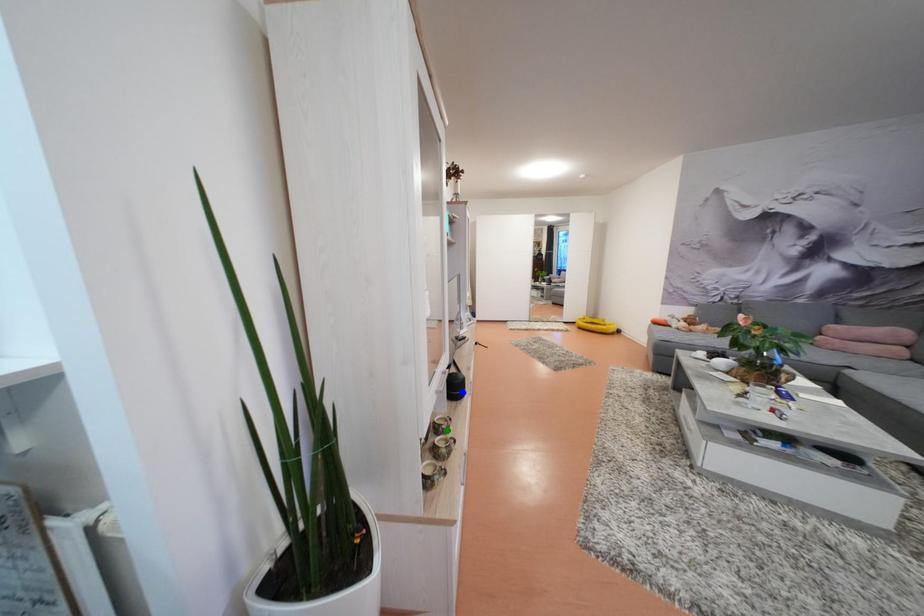
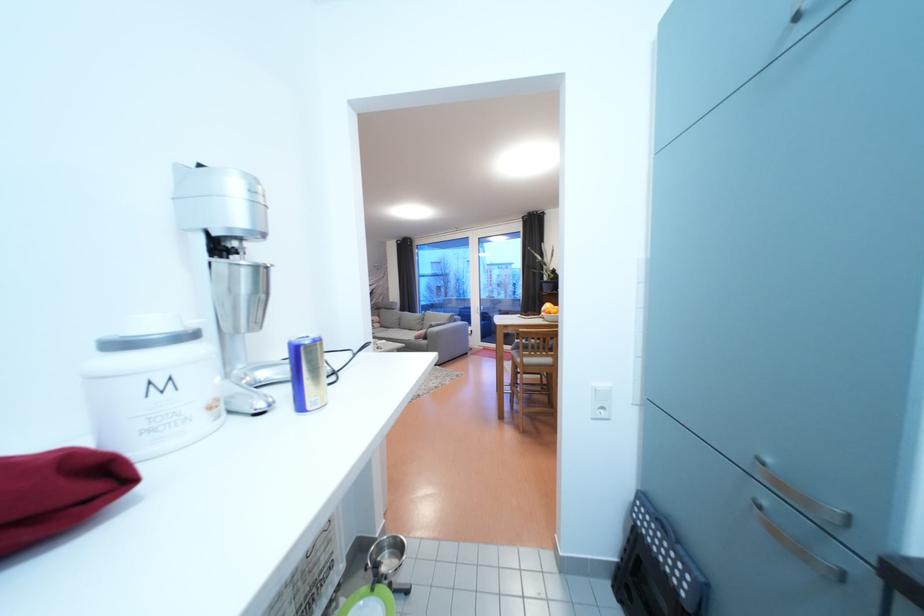
I am providing you with two images of the same scene from different viewpoints. Three points are marked in image1. Which point corresponds to a part or object that is occluded in image2?In image1, three points are marked. Which of them correspond to a part or object that is occluded in image2?Among the three points shown in image1, which one corresponds to a part or object that is no longer visible due to occlusion in image2?

yellow point, blue point, green point cannot be seen in image2.